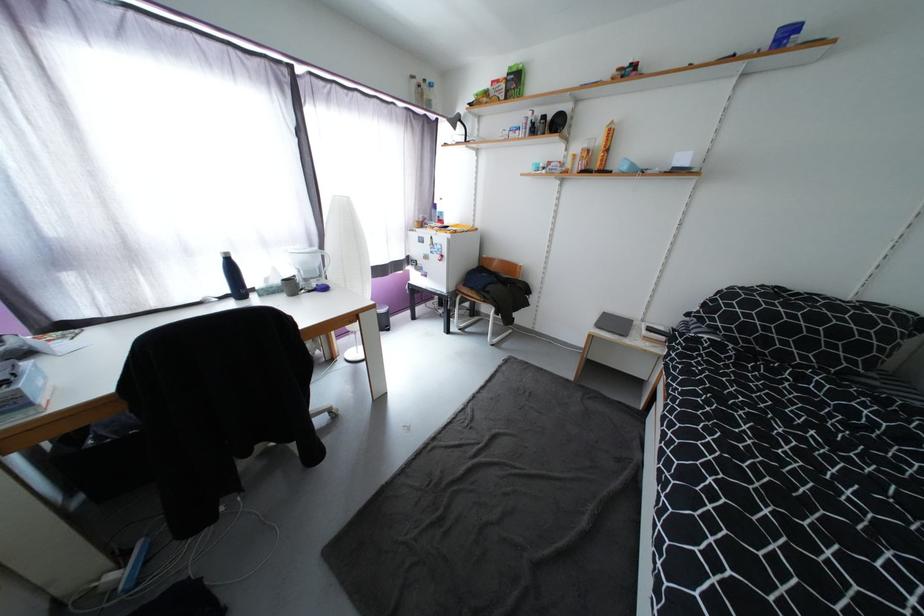
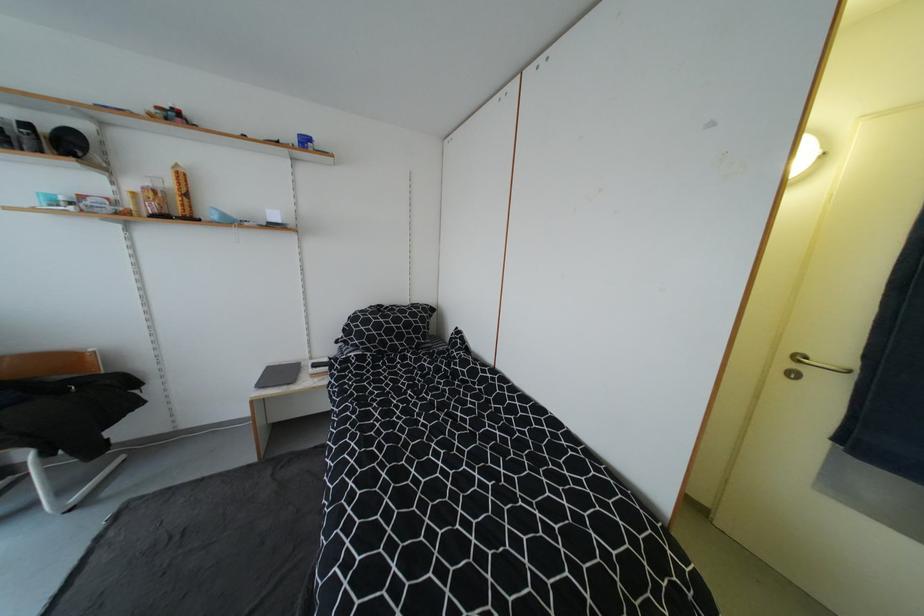
Locate, in the second image, the point that corresponds to (x=619, y=325) in the first image.

(286, 376)